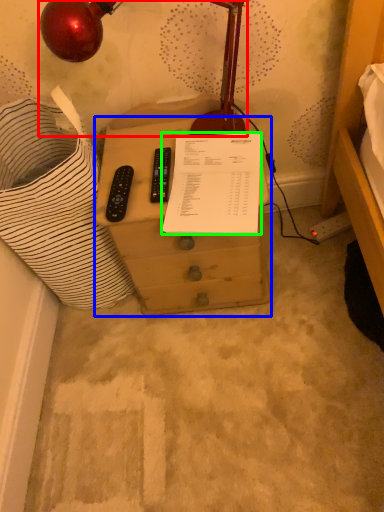
Question: Which object is positioned farthest from lamp (highlighted by a red box)? Select from furniture (highlighted by a blue box) and document (highlighted by a green box).

Choices:
 (A) furniture
 (B) document

Answer: (A)